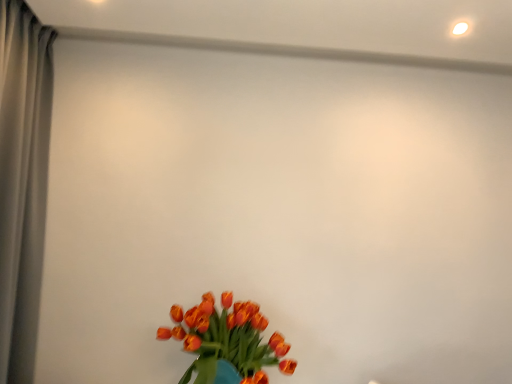
This screenshot has height=384, width=512. What do you see at coordinates (227, 342) in the screenshot?
I see `orange matte tulips at lower center` at bounding box center [227, 342].

Where is `orange matte tulips at lower center`? This screenshot has height=384, width=512. orange matte tulips at lower center is located at coordinates (227, 342).

The height and width of the screenshot is (384, 512). What do you see at coordinates (22, 181) in the screenshot?
I see `gray fabric curtain at left` at bounding box center [22, 181].

Find the location of a particular element. This screenshot has height=384, width=512. gray fabric curtain at left is located at coordinates (22, 181).

Identify the location of orange matte tulips at lower center. (227, 342).

Is orange matte tulips at lower center to the right of gray fabric curtain at left from the viewer's perspective?

Yes, orange matte tulips at lower center is to the right of gray fabric curtain at left.

Who is more distant, orange matte tulips at lower center or gray fabric curtain at left?

orange matte tulips at lower center is further from the camera.

Considering the positions of point (200, 354) and point (7, 27), is point (200, 354) closer or farther from the camera than point (7, 27)?

Point (200, 354) is positioned farther from the camera compared to point (7, 27).

From the image's perspective, which one is positioned higher, orange matte tulips at lower center or gray fabric curtain at left?

gray fabric curtain at left appears higher in the image.

From a real-world perspective, between orange matte tulips at lower center and gray fabric curtain at left, who is vertically lower?

orange matte tulips at lower center, from a real-world perspective.

Which of these two, orange matte tulips at lower center or gray fabric curtain at left, is wider?

orange matte tulips at lower center.

From their relative heights in the image, would you say orange matte tulips at lower center is taller or shorter than gray fabric curtain at left?

Considering their sizes, orange matte tulips at lower center has less height than gray fabric curtain at left.

Can you confirm if orange matte tulips at lower center is bigger than gray fabric curtain at left?

Incorrect, orange matte tulips at lower center is not larger than gray fabric curtain at left.

Consider the image. Is orange matte tulips at lower center located outside gray fabric curtain at left?

Indeed, orange matte tulips at lower center is completely outside gray fabric curtain at left.

Is orange matte tulips at lower center not close to gray fabric curtain at left?

That's not correct — orange matte tulips at lower center is a little close to gray fabric curtain at left.

Could you tell me if orange matte tulips at lower center is facing gray fabric curtain at left?

No, orange matte tulips at lower center is not oriented towards gray fabric curtain at left.

Measure the distance between orange matte tulips at lower center and gray fabric curtain at left.

orange matte tulips at lower center is 36.62 inches away from gray fabric curtain at left.

This screenshot has height=384, width=512. I want to click on flower that appears below the gray fabric curtain at left (from the image's perspective), so click(x=227, y=342).

Is gray fabric curtain at left to the left of orange matte tulips at lower center from the viewer's perspective?

Yes.

Is gray fabric curtain at left closer to the viewer compared to orange matte tulips at lower center?

Yes, it is.

Is point (9, 97) closer to camera compared to point (202, 341)?

That is True.

From the image's perspective, is gray fabric curtain at left above or below orange matte tulips at lower center?

gray fabric curtain at left is situated higher than orange matte tulips at lower center in the image.

From a real-world perspective, between gray fabric curtain at left and orange matte tulips at lower center, who is vertically higher?

gray fabric curtain at left.

In terms of width, does gray fabric curtain at left look wider or thinner when compared to orange matte tulips at lower center?

gray fabric curtain at left is thinner than orange matte tulips at lower center.

Considering the relative sizes of gray fabric curtain at left and orange matte tulips at lower center in the image provided, is gray fabric curtain at left shorter than orange matte tulips at lower center?

No, gray fabric curtain at left is not shorter than orange matte tulips at lower center.

Does gray fabric curtain at left have a larger size compared to orange matte tulips at lower center?

Yes, gray fabric curtain at left is bigger than orange matte tulips at lower center.

Is gray fabric curtain at left not inside orange matte tulips at lower center?

gray fabric curtain at left lies outside orange matte tulips at lower center's area.

Is gray fabric curtain at left not close to orange matte tulips at lower center?

No, gray fabric curtain at left is in close proximity to orange matte tulips at lower center.

Is gray fabric curtain at left looking in the opposite direction of orange matte tulips at lower center?

No, gray fabric curtain at left is not facing away from orange matte tulips at lower center.

How different are the orientations of gray fabric curtain at left and orange matte tulips at lower center in degrees?

gray fabric curtain at left and orange matte tulips at lower center are facing 88.3 degrees away from each other.

Locate an element on the screen. This screenshot has width=512, height=384. curtain that is above the orange matte tulips at lower center (from a real-world perspective) is located at coordinates (22, 181).

The width and height of the screenshot is (512, 384). I want to click on curtain in front of the orange matte tulips at lower center, so click(x=22, y=181).

At what (x,y) coordinates should I click in order to perform the action: click on flower on the right of gray fabric curtain at left. Please return your answer as a coordinate pair (x, y). The height and width of the screenshot is (384, 512). Looking at the image, I should click on (x=227, y=342).